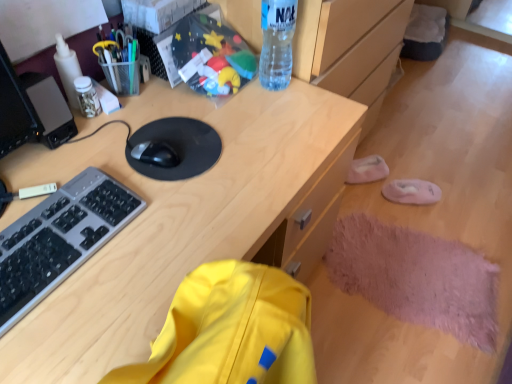
Locate an element on the screen. The width and height of the screenshot is (512, 384). free area in between black matte mousepad at center and white plastic bottle at upper left, the 2th bottle from the right is located at coordinates (117, 121).